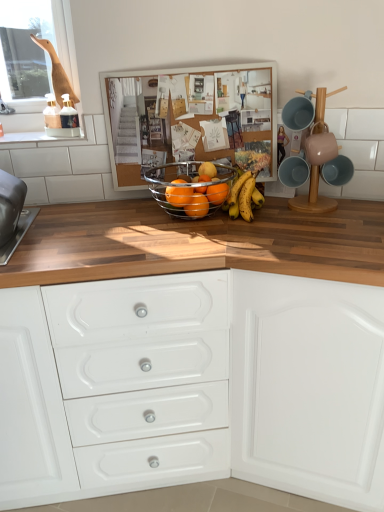
Locate an element on the screen. This screenshot has width=384, height=512. free spot in front of glossy orange at center, which is the fourth orange in left-to-right order is located at coordinates (220, 234).